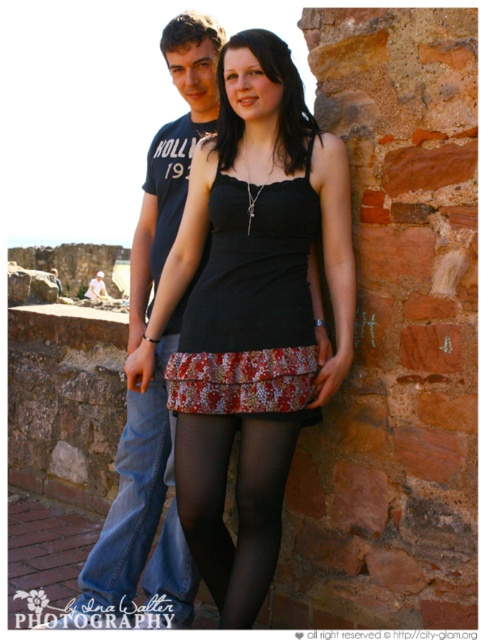
The height and width of the screenshot is (640, 485). Describe the element at coordinates (130, 499) in the screenshot. I see `denim jeans at center` at that location.

Which is behind, point (64, 616) or point (242, 202)?

Point (242, 202)

Which is in front, point (173, 166) or point (190, 308)?

Point (190, 308)

Identify the location of denim jeans at center. The image size is (485, 640). [130, 499].

Image resolution: width=485 pixels, height=640 pixels. Describe the element at coordinates (251, 314) in the screenshot. I see `black satin dress at center` at that location.

Describe the element at coordinates (251, 314) in the screenshot. The width and height of the screenshot is (485, 640). I see `black satin dress at center` at that location.

Find the location of a particular element. black satin dress at center is located at coordinates (251, 314).

Who is higher up, black satin dress at center or black sheer tights at center?

Positioned higher is black satin dress at center.

Is black satin dress at center taller than black sheer tights at center?

Yes.

Is point (249, 588) less distant than point (208, 502)?

Yes, point (249, 588) is in front of point (208, 502).

Where is `black satin dress at center`? black satin dress at center is located at coordinates (251, 314).